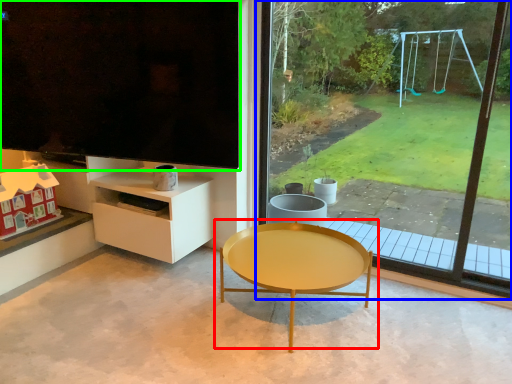
Question: Estimate the real-world distances between objects in this image. Which object is closer to coffee table (highlighted by a red box), window (highlighted by a blue box) or window screen (highlighted by a green box)?

Choices:
 (A) window
 (B) window screen

Answer: (B)